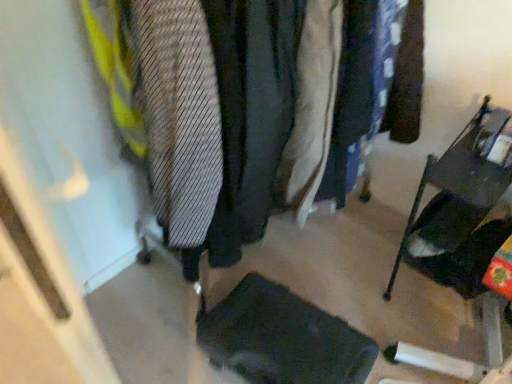
Question: Does metallic dark gray folding chair at right have a greater width compared to light beige fabric coat at center?

Choices:
 (A) yes
 (B) no

Answer: (A)

Question: Considering the relative sizes of metallic dark gray folding chair at right and light beige fabric coat at center in the image provided, is metallic dark gray folding chair at right shorter than light beige fabric coat at center?

Choices:
 (A) yes
 (B) no

Answer: (A)

Question: From the image's perspective, is metallic dark gray folding chair at right on top of light beige fabric coat at center?

Choices:
 (A) no
 (B) yes

Answer: (A)

Question: Is metallic dark gray folding chair at right thinner than light beige fabric coat at center?

Choices:
 (A) yes
 (B) no

Answer: (B)

Question: Considering the relative sizes of metallic dark gray folding chair at right and light beige fabric coat at center in the image provided, is metallic dark gray folding chair at right taller than light beige fabric coat at center?

Choices:
 (A) yes
 (B) no

Answer: (B)

Question: Is metallic dark gray folding chair at right to the left of light beige fabric coat at center from the viewer's perspective?

Choices:
 (A) no
 (B) yes

Answer: (A)

Question: Is black fabric footrest at lower center far away from light beige fabric coat at center?

Choices:
 (A) no
 (B) yes

Answer: (A)

Question: Considering the relative positions of black fabric footrest at lower center and light beige fabric coat at center in the image provided, is black fabric footrest at lower center to the left of light beige fabric coat at center from the viewer's perspective?

Choices:
 (A) no
 (B) yes

Answer: (B)

Question: Is black fabric footrest at lower center with light beige fabric coat at center?

Choices:
 (A) no
 (B) yes

Answer: (A)

Question: Is black fabric footrest at lower center smaller than light beige fabric coat at center?

Choices:
 (A) no
 (B) yes

Answer: (B)

Question: Is black fabric footrest at lower center positioned with its back to light beige fabric coat at center?

Choices:
 (A) no
 (B) yes

Answer: (A)

Question: From a real-world perspective, is black fabric footrest at lower center over light beige fabric coat at center?

Choices:
 (A) yes
 (B) no

Answer: (B)

Question: Is light beige fabric coat at center bigger than black fabric footrest at lower center?

Choices:
 (A) yes
 (B) no

Answer: (A)